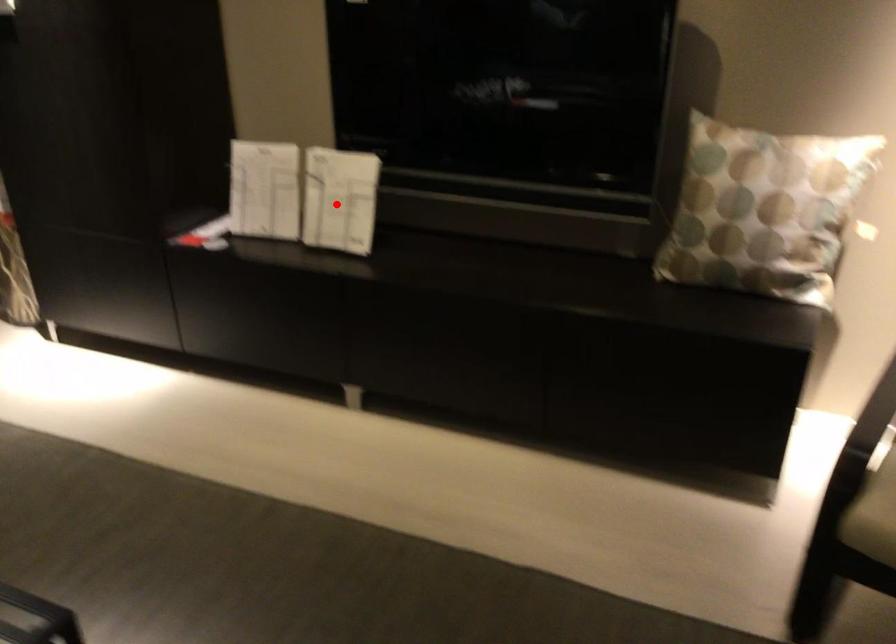
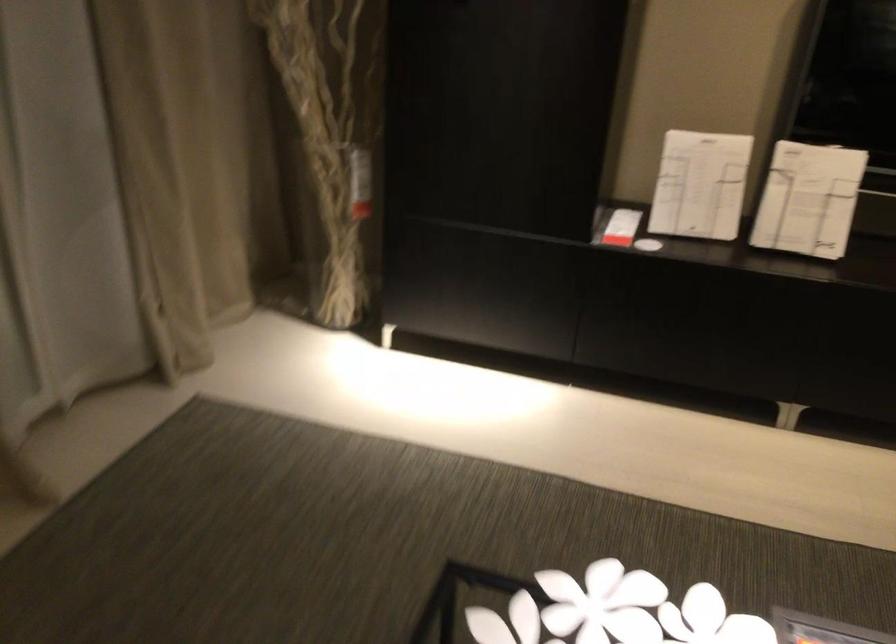
Question: I am providing you with two images of the same scene from different viewpoints. Given a red point in image1, look at the same physical point in image2. Is it:

Choices:
 (A) Closer to the viewpoint
 (B) Farther from the viewpoint

Answer: (A)